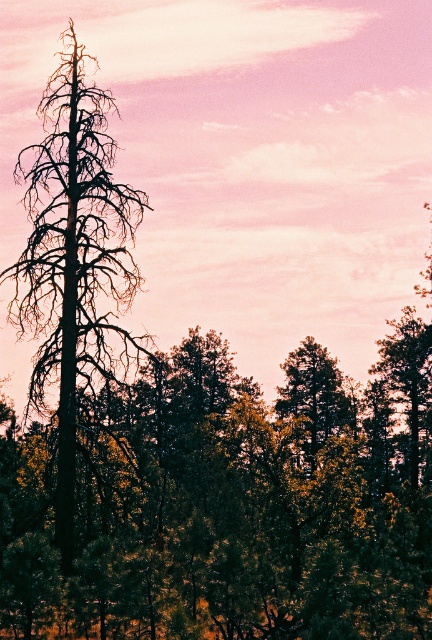
Does dark brown bark tree at left have a lesser height compared to green matte tree at center?

No.

Is dark brown bark tree at left smaller than green matte tree at center?

Incorrect, dark brown bark tree at left is not smaller in size than green matte tree at center.

Is point (56, 92) closer to camera compared to point (333, 390)?

Yes, it is in front of point (333, 390).

Find the location of a particular element. The width and height of the screenshot is (432, 640). dark brown bark tree at left is located at coordinates (73, 257).